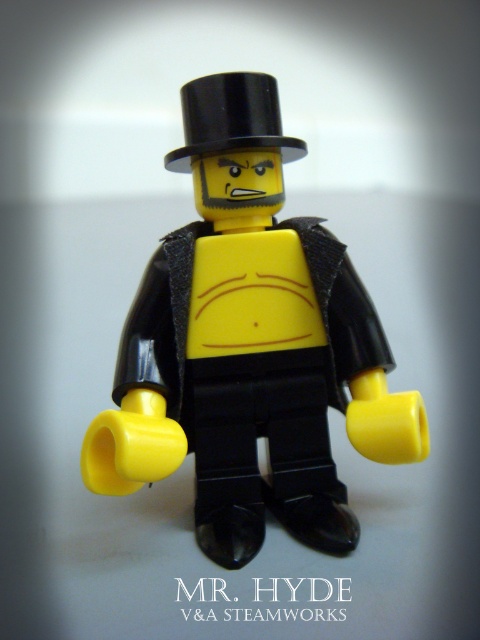
Which is behind, point (156, 305) or point (213, 122)?

Positioned behind is point (156, 305).

Consider the image. Does matte black minifigure at center appear on the left side of black glossy top hat at upper center?

In fact, matte black minifigure at center is to the right of black glossy top hat at upper center.

Describe the element at coordinates (249, 346) in the screenshot. I see `matte black minifigure at center` at that location.

You are a GUI agent. You are given a task and a screenshot of the screen. Output one action in this format:
    pyautogui.click(x=<x>, y=<y>)
    Task: Click on the matte black minifigure at center
    This screenshot has height=640, width=480.
    Given the screenshot: What is the action you would take?
    pyautogui.click(x=249, y=346)